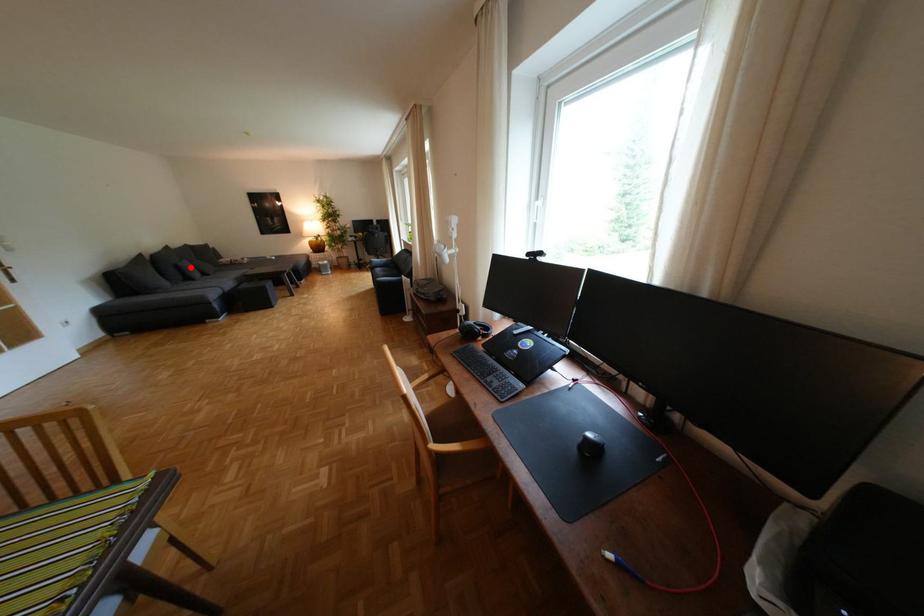
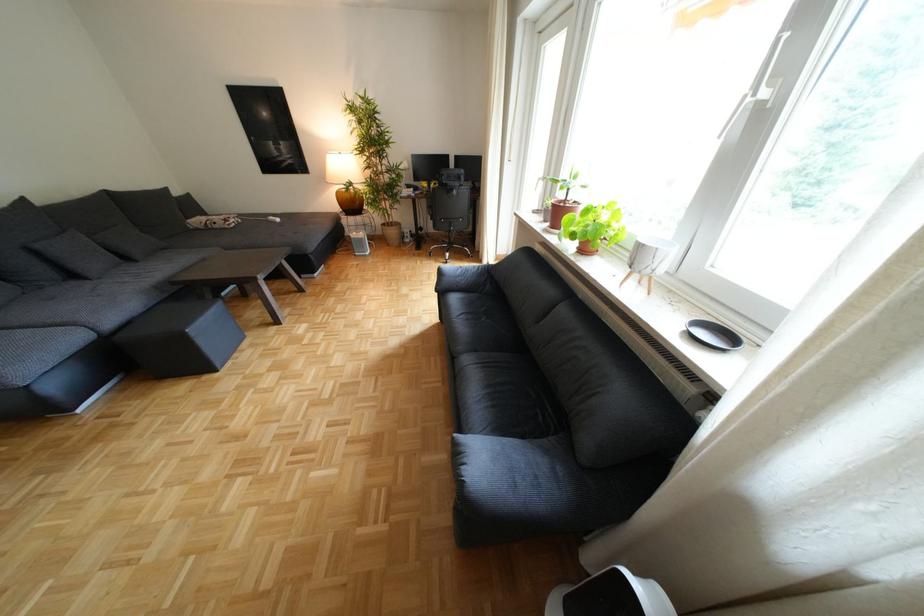
Where in the second image is the point corresponding to the highlighted location from the first image?

(49, 253)